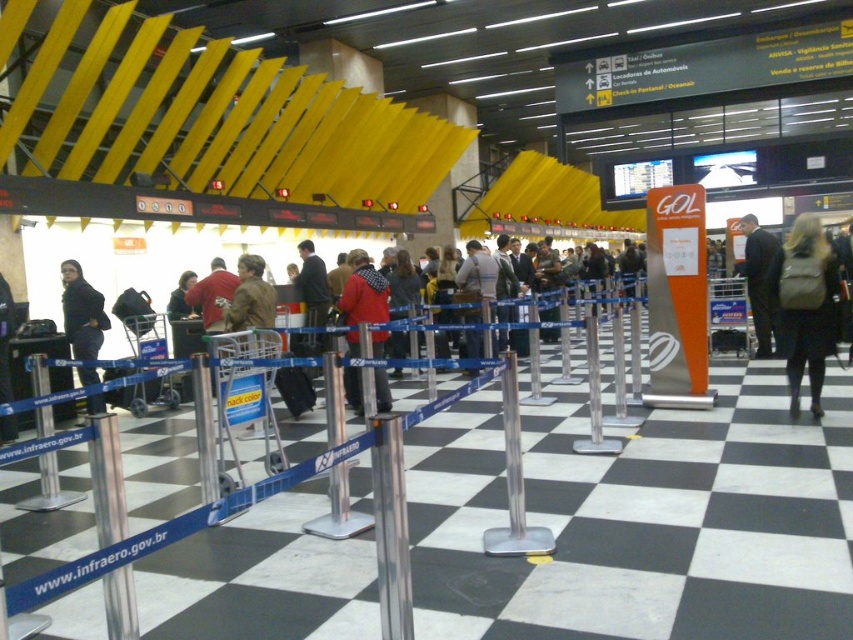
Locate an element on the screen. This screenshot has height=640, width=853. leather backpack at right is located at coordinates (805, 305).

Who is shorter, leather backpack at right or red woolen sweater at center?

With less height is leather backpack at right.

Does leather backpack at right appear over red woolen sweater at center?

Actually, leather backpack at right is below red woolen sweater at center.

Find the location of `leather backpack at right`. leather backpack at right is located at coordinates (805, 305).

Find the location of a particular element. The height and width of the screenshot is (640, 853). leather backpack at right is located at coordinates (805, 305).

Does silver metallic stanchion at center have a larger size compared to dark suit at right?

Actually, silver metallic stanchion at center might be smaller than dark suit at right.

Is silver metallic stanchion at center in front of dark suit at right?

That is True.

Find the location of a particular element. The image size is (853, 640). silver metallic stanchion at center is located at coordinates (543, 522).

What are the coordinates of `silver metallic stanchion at center` in the screenshot? It's located at (543, 522).